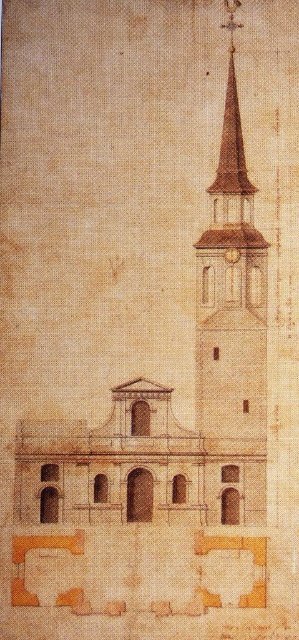
You are an architect reviewing the historical drawing of the church. You notice the brown brick bell tower at upper right and the gold textured clock at center. Which object occupies more horizontal space in the drawing?

The brown brick bell tower at upper right is wider than the gold textured clock at center, so it occupies more horizontal space in the drawing.

You are an architect reviewing a historical sketch of a church. You need to locate the brown brick bell tower at upper right. Where exactly is it positioned in the image?

The brown brick bell tower at upper right is positioned at point 0.455 on the x axis and 0.776 on the y axis.